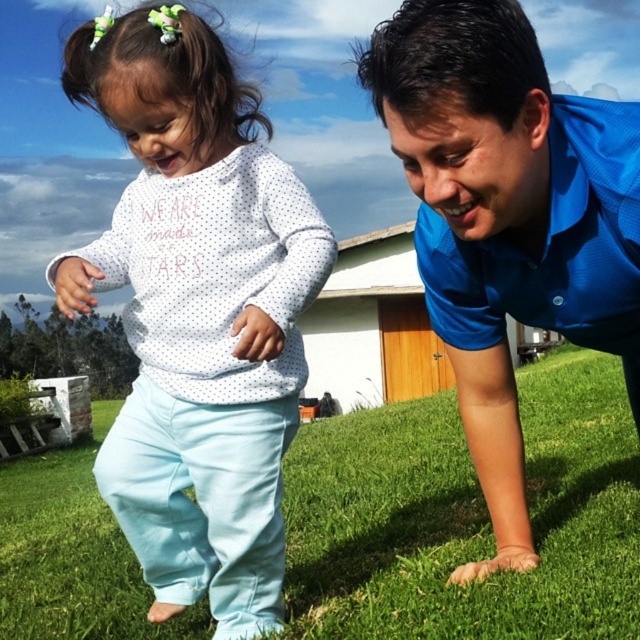
You are standing in the grassy area and see two points marked in the image. Which point is closer to you, point (3, 518) or point (516, 292)?

Point (3, 518) is closer to you because it is further to the camera than point (516, 292).